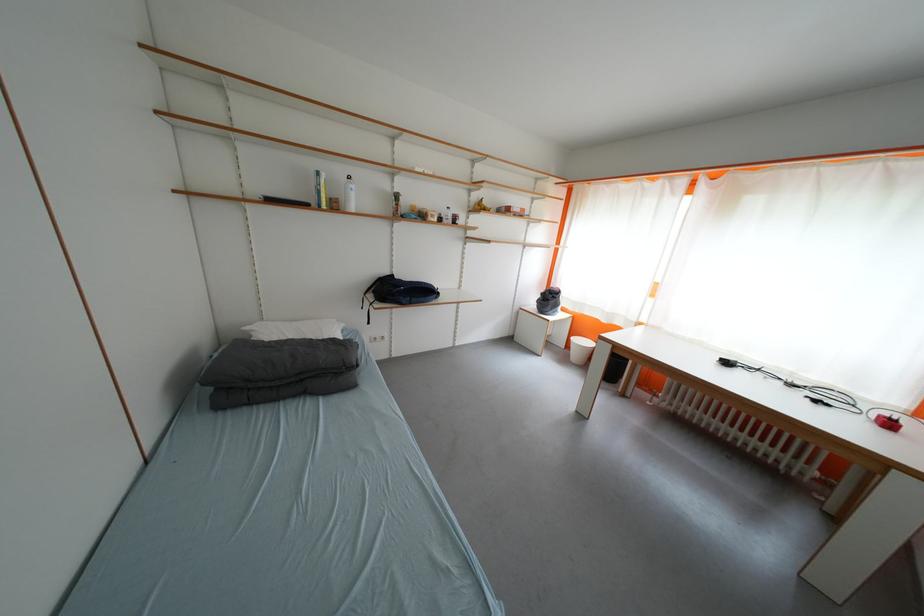
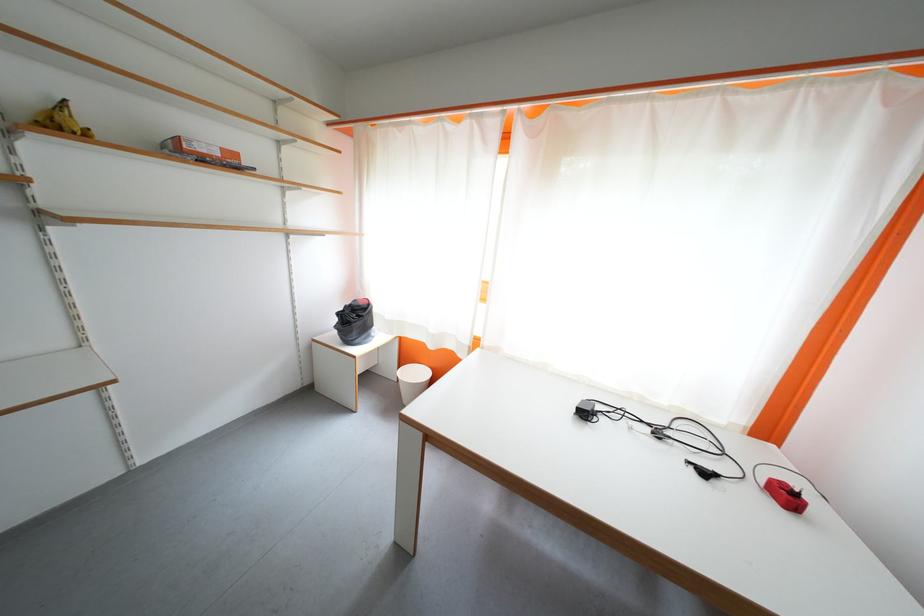
The point at (613, 323) is marked in the first image. Where is the corresponding point in the second image?

(440, 350)